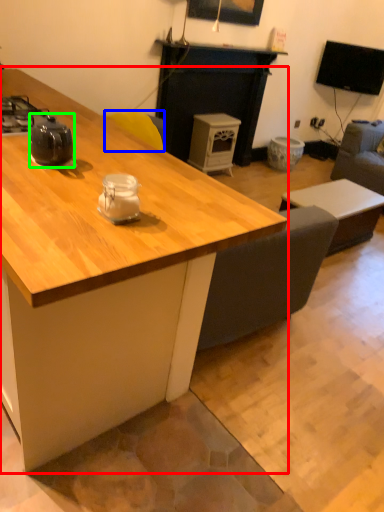
Question: Estimate the real-world distances between objects in this image. Which object is closer to desk (highlighted by a red box), armchair (highlighted by a blue box) or tea pot (highlighted by a green box)?

Choices:
 (A) armchair
 (B) tea pot

Answer: (B)